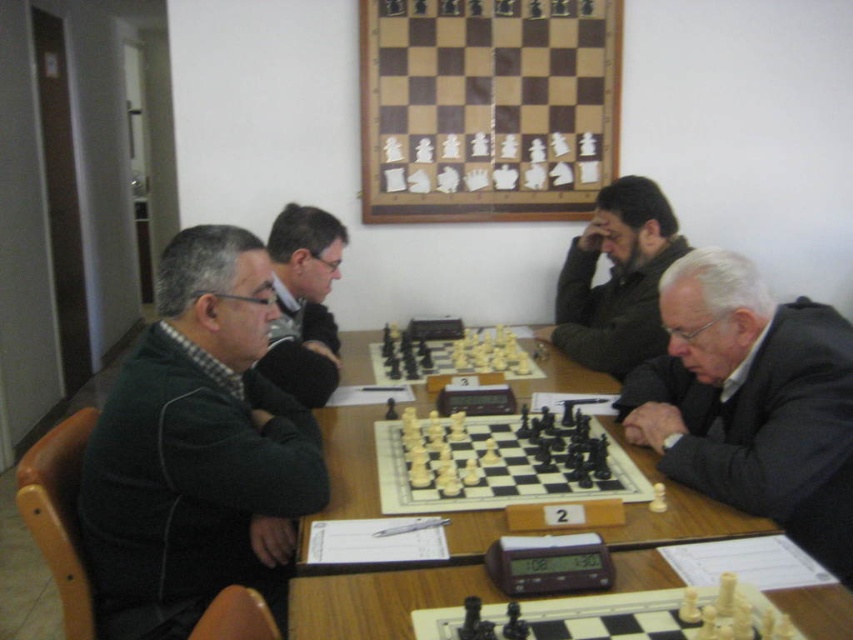
You are a chess player who wants to choose a set of chess pieces that are easier to handle. Based on the image, which set would you recommend between the white plastic chess pieces at center and the wooden chess set at center?

The white plastic chess pieces at center has a smaller size compared to wooden chess set at center, so the wooden chess set at center would be easier to handle due to its larger size.

You are a chess player trying to choose between the white plastic chess pieces at center and the wooden chess set at center for your next game. Which set has a larger piece size?

The white plastic chess pieces at center have a larger width than the wooden chess set at center, so they are the larger set.

You are a participant in the chess tournament and want to place a chess piece at the point closer to you between point (653, 218) and point (338, 438). Which point should you choose?

Point (653, 218) is further to the viewer than point (338, 438), so you should choose point (653, 218) as it is closer to you.